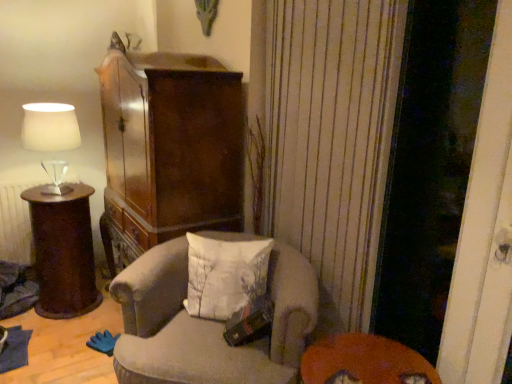
Question: From a real-world perspective, is dark brown polished wood side table at left over transparent glass screen door at right?

Choices:
 (A) yes
 (B) no

Answer: (B)

Question: From a real-world perspective, is dark brown polished wood side table at left located beneath transparent glass screen door at right?

Choices:
 (A) yes
 (B) no

Answer: (A)

Question: Considering the relative sizes of dark brown polished wood side table at left and transparent glass screen door at right in the image provided, is dark brown polished wood side table at left wider than transparent glass screen door at right?

Choices:
 (A) no
 (B) yes

Answer: (B)

Question: Can you confirm if dark brown polished wood side table at left is thinner than transparent glass screen door at right?

Choices:
 (A) yes
 (B) no

Answer: (B)

Question: From the image's perspective, does dark brown polished wood side table at left appear lower than transparent glass screen door at right?

Choices:
 (A) no
 (B) yes

Answer: (B)

Question: From a real-world perspective, is dark brown polished wood side table at left above or below white fabric pillow at center?

Choices:
 (A) above
 (B) below

Answer: (B)

Question: Considering the positions of dark brown polished wood side table at left and white fabric pillow at center in the image, is dark brown polished wood side table at left taller or shorter than white fabric pillow at center?

Choices:
 (A) short
 (B) tall

Answer: (B)

Question: Considering the relative positions of dark brown polished wood side table at left and white fabric pillow at center in the image provided, is dark brown polished wood side table at left to the left or to the right of white fabric pillow at center?

Choices:
 (A) right
 (B) left

Answer: (B)

Question: Is dark brown polished wood side table at left wider or thinner than white fabric pillow at center?

Choices:
 (A) thin
 (B) wide

Answer: (B)

Question: Which is correct: white fabric lampshade at left is inside orange felt table at lower right, or outside of it?

Choices:
 (A) outside
 (B) inside

Answer: (A)

Question: From a real-world perspective, is white fabric lampshade at left above or below orange felt table at lower right?

Choices:
 (A) above
 (B) below

Answer: (A)

Question: From their relative heights in the image, would you say white fabric lampshade at left is taller or shorter than orange felt table at lower right?

Choices:
 (A) tall
 (B) short

Answer: (A)

Question: Does point (57, 112) appear closer or farther from the camera than point (315, 364)?

Choices:
 (A) closer
 (B) farther

Answer: (B)

Question: In terms of width, does white fabric lampshade at left look wider or thinner when compared to velvet beige armchair at center?

Choices:
 (A) wide
 (B) thin

Answer: (B)

Question: From a real-world perspective, relative to velvet beige armchair at center, is white fabric lampshade at left vertically above or below?

Choices:
 (A) below
 (B) above

Answer: (B)